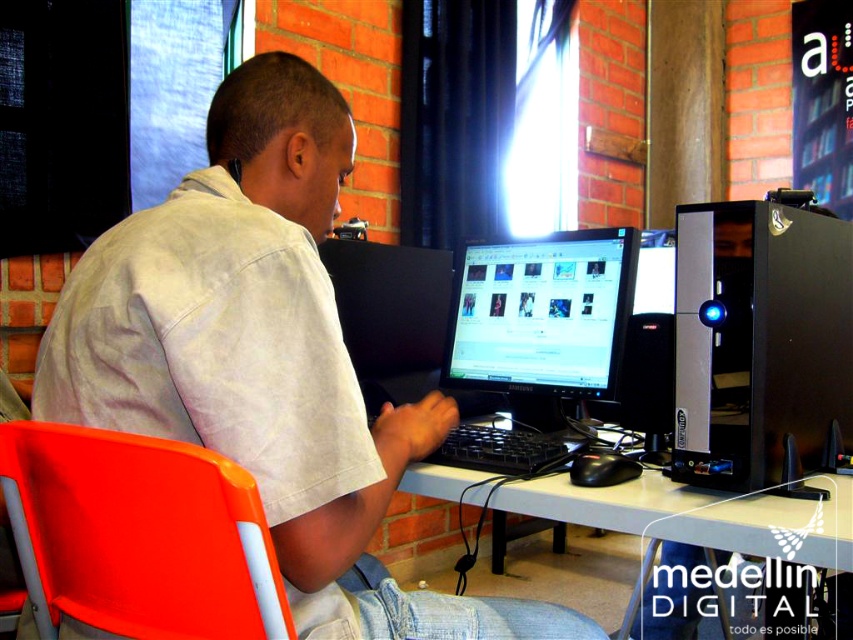
You are a person who wants to adjust your posture to be at a comfortable distance from the computer screen. The recommended distance between your eyes and the screen is between 20 to 24 inches. Based on the image, is the current distance between the matte white shirt at center and the black glossy monitor at center within the recommended range?

The matte white shirt at center is 20.23 inches away from the black glossy monitor at center. Since the recommended distance is between 20 to 24 inches, the current distance is within the recommended range.

You are a delivery person who needs to place a small package between the black glossy monitor at center and the camera. The package requires at least 1.5 meters of space to be placed safely. Can you fit the package between them?

The distance between the black glossy monitor at center and the camera is 1.32 meters, which is less than the required 1.5 meters. Therefore, the package cannot be safely placed between them.

You are a person sitting in front of the desk and want to reach the black glossy monitor at center. Since the white plastic computer desk at center is between you and the monitor, can you easily access it without moving the desk?

The black glossy monitor at center is further to the viewer than the white plastic computer desk at center, meaning the desk is closer to you. Therefore, the desk is blocking your direct access to the monitor. To reach the monitor, you would need to move around the desk or adjust its position.